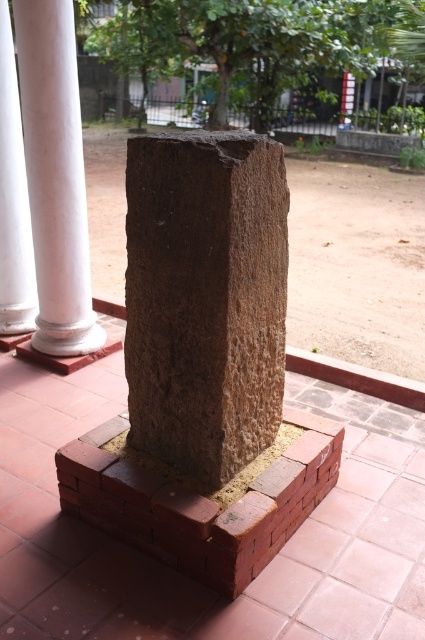
You are a construction worker who needs to place a new decorative item on the tiled patio. The item requires a surface area larger than the brown rough stone at center. Can you use the red brick at center as a base for this item?

The brown rough stone at center is bigger than the red brick at center, so the red brick at center is smaller. Therefore, the red brick at center cannot provide enough surface area for the item that requires a base larger than the brown rough stone at center.

You are standing on the tiled patio and want to place a small potted plant between the brown rough stone at center and the red brick at center. Based on their positions, where should you place the plant?

The brown rough stone at center is located above the red brick at center, so you should place the potted plant between them horizontally, not vertically, since the stone is above the brick.

You are an architect designing a new outdoor space and want to place a statue between the smooth white column at center and the white smooth column at left. Which column should the statue be closer to if you want it to appear balanced given their heights?

The smooth white column at center is shorter than the white smooth column at left. To create a balanced appearance, the statue should be placed closer to the taller column, which is the white smooth column at left.